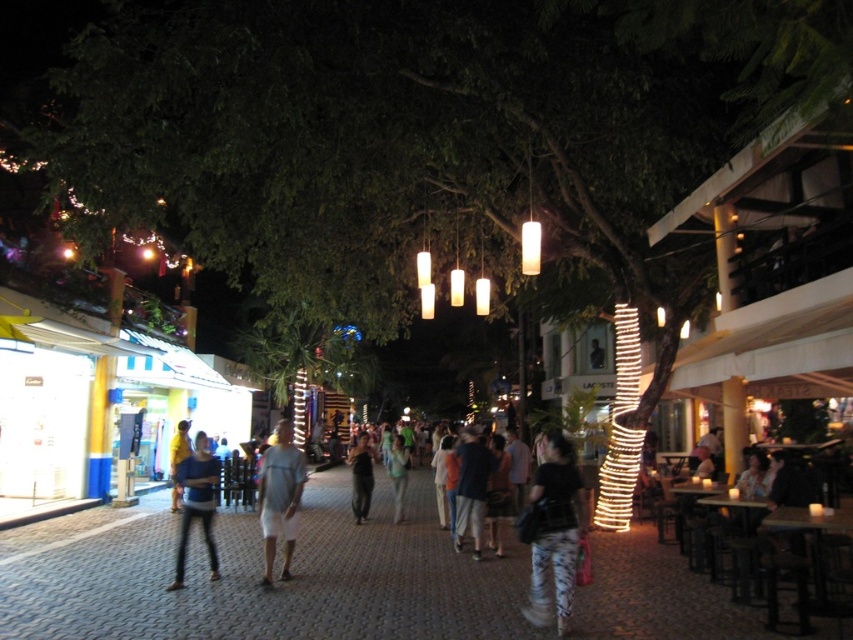
Question: Which point is farther to the camera?

Choices:
 (A) yellow fabric at center
 (B) light blue denim jeans at center
 (C) white cotton shorts at center

Answer: (A)

Question: Is green leafy tree at center below matte blue shirt at center?

Choices:
 (A) yes
 (B) no

Answer: (A)

Question: Where is white cotton shorts at center located in relation to dark blue shirt at center in the image?

Choices:
 (A) below
 (B) above

Answer: (B)

Question: Where is white cotton shorts at center located in relation to matte blue shirt at center in the image?

Choices:
 (A) below
 (B) above

Answer: (B)

Question: Which object is the farthest from the matte blue shirt at center?

Choices:
 (A) white cotton shorts at center
 (B) yellow fabric at center

Answer: (B)

Question: Which point is closer to the camera?

Choices:
 (A) light blue denim jeans at center
 (B) white cotton shorts at center
 (C) dark brown leather jacket at center
 (D) black matte bag at lower right

Answer: (D)